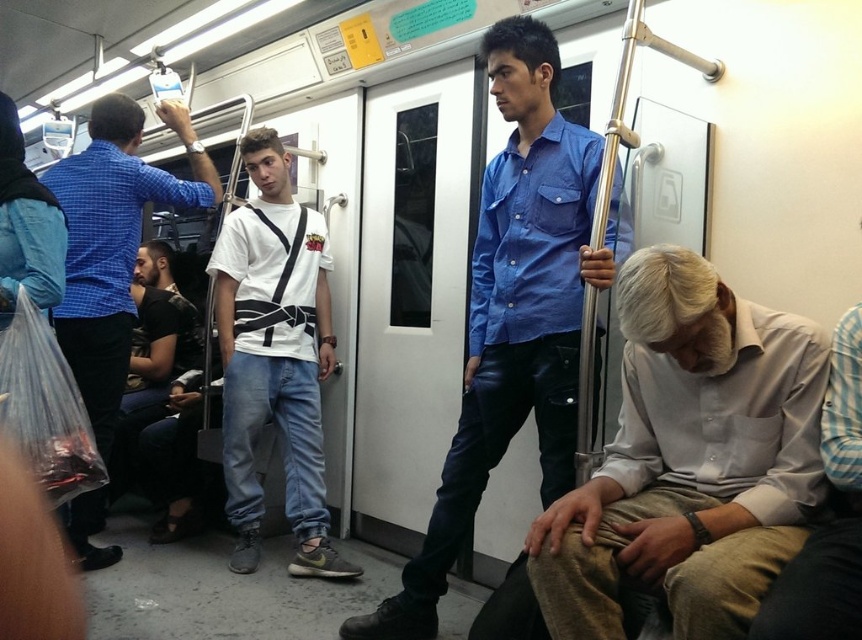
You are a passenger on a subway train and want to know if the blue cotton shirt at center is wider than the brushed metal shirt at left. Can you determine this based on the scene?

The blue cotton shirt at center is wider than the brushed metal shirt at left according to the description.

You are a passenger on a subway train and want to find the gray cotton shirt at lower right. According to the scene description, where should you look in the image?

The gray cotton shirt at lower right is located at the 2D coordinates point [689,460] in the image.